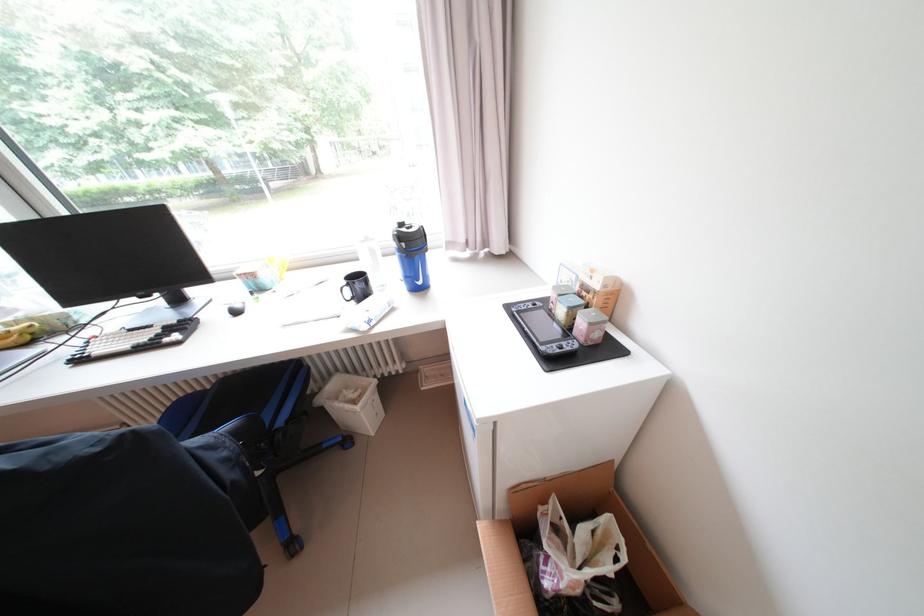
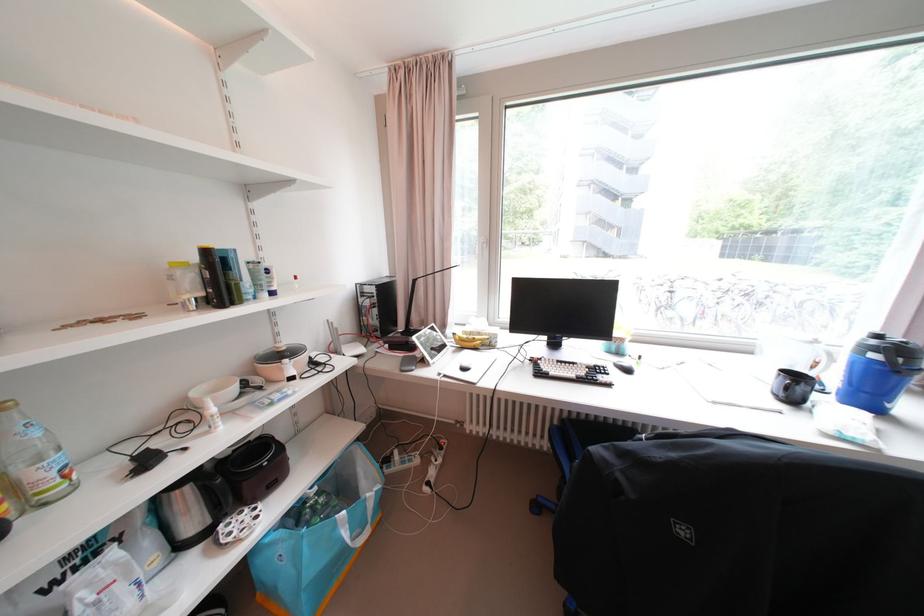
Find the pixel in the second image that matches point (177, 304) in the first image.

(555, 346)